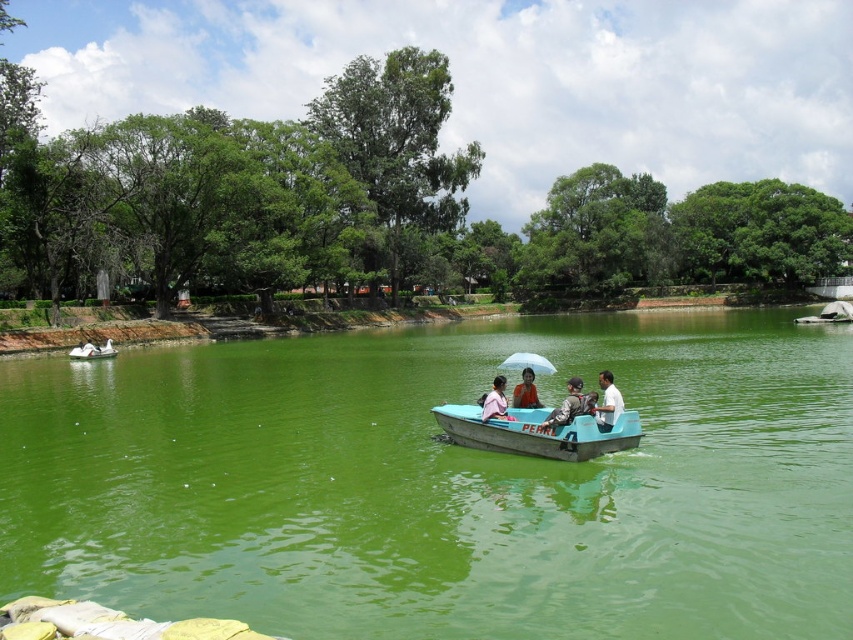
Question: Is white matte umbrella at center wider than white rubber boat at lower left?

Choices:
 (A) yes
 (B) no

Answer: (B)

Question: Can you confirm if matte gray jacket at center is positioned above pink fabric shirt at center?

Choices:
 (A) yes
 (B) no

Answer: (B)

Question: Does green plastic boat at center lie behind orange fabric shirt at center?

Choices:
 (A) no
 (B) yes

Answer: (A)

Question: Which object is the farthest from the white rubber boat at lower left?

Choices:
 (A) white matte umbrella at center
 (B) pink fabric shirt at center
 (C) orange fabric shirt at center

Answer: (B)

Question: Estimate the real-world distances between objects in this image. Which object is closer to the white cotton shirt at center?

Choices:
 (A) green plastic boat at center
 (B) teal plastic boat at center
 (C) matte gray jacket at center
 (D) white rubber boat at lower left

Answer: (C)

Question: Which point is farther from the camera taking this photo?

Choices:
 (A) (566, 406)
 (B) (511, 365)

Answer: (B)